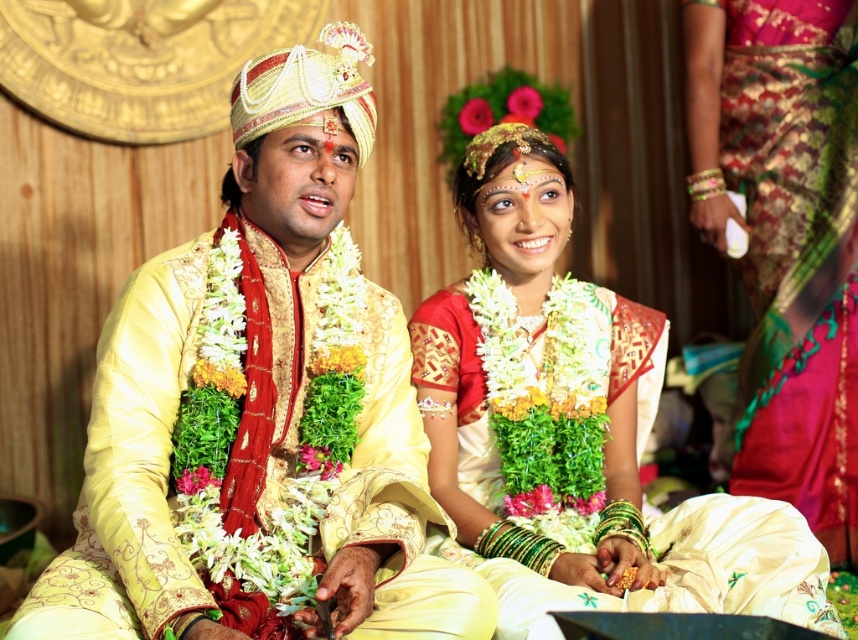
In the traditional Indian wedding scene, you notice a matte gold kurta at center and a matte gold saree at center. Which one is positioned closer to the front of the image?

The matte gold kurta at center is positioned in front of the matte gold saree at center, so it is closer to the front of the image.